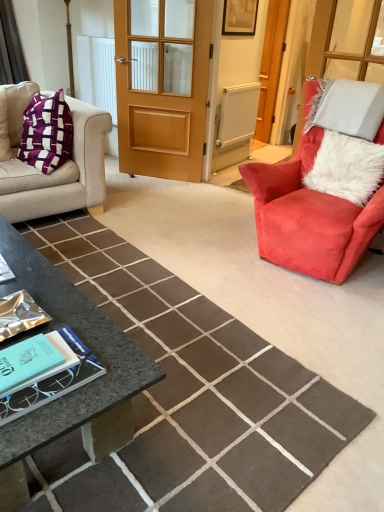
Question: Is teal matte book at lower left taller than wooden screen door at center?

Choices:
 (A) no
 (B) yes

Answer: (A)

Question: Is teal matte book at lower left outside of wooden screen door at center?

Choices:
 (A) no
 (B) yes

Answer: (B)

Question: Is teal matte book at lower left wider than wooden screen door at center?

Choices:
 (A) yes
 (B) no

Answer: (A)

Question: Does teal matte book at lower left turn towards wooden screen door at center?

Choices:
 (A) no
 (B) yes

Answer: (A)

Question: Is teal matte book at lower left shorter than wooden screen door at center?

Choices:
 (A) no
 (B) yes

Answer: (B)

Question: Is teal matte book at lower left positioned before wooden screen door at center?

Choices:
 (A) yes
 (B) no

Answer: (A)

Question: Can you confirm if granite coffee table at lower left is wider than white textured radiator at center?

Choices:
 (A) no
 (B) yes

Answer: (B)

Question: Can you confirm if granite coffee table at lower left is positioned to the right of white textured radiator at center?

Choices:
 (A) yes
 (B) no

Answer: (B)

Question: Is granite coffee table at lower left facing towards white textured radiator at center?

Choices:
 (A) yes
 (B) no

Answer: (B)

Question: Is granite coffee table at lower left thinner than white textured radiator at center?

Choices:
 (A) no
 (B) yes

Answer: (A)

Question: From a real-world perspective, is granite coffee table at lower left on white textured radiator at center?

Choices:
 (A) yes
 (B) no

Answer: (B)

Question: From the image's perspective, would you say granite coffee table at lower left is shown under white textured radiator at center?

Choices:
 (A) no
 (B) yes

Answer: (B)

Question: Is velvet red armchair at right facing away from wooden door at center?

Choices:
 (A) no
 (B) yes

Answer: (A)